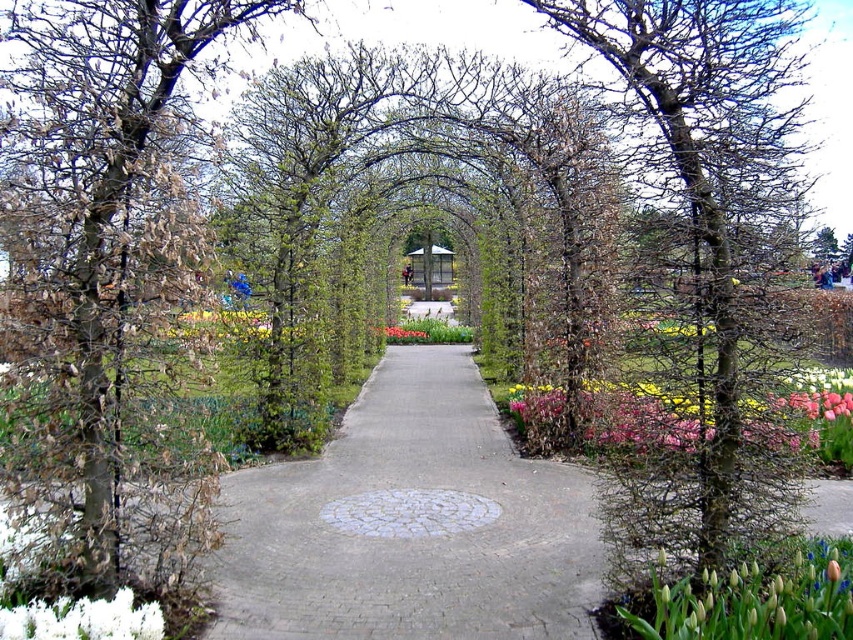
You are a gardener who needs to plant a new tulip that requires 1 meter of space above it to grow. Looking at the garden pathway with the brown bark tree at left and the green matte tulip at lower right, which object would allow enough vertical space for the new tulip to grow?

The brown bark tree at left is much taller than the green matte tulip at lower right, so the new tulip would have enough vertical space if planted near the brown bark tree at left.

You are a gardener who needs to water the green matte tulip at lower right and the green leafy tree at center. Based on their positions, which one do you think is closer to you?

The green matte tulip at lower right is in front of the green leafy tree at center, so it is closer to you.